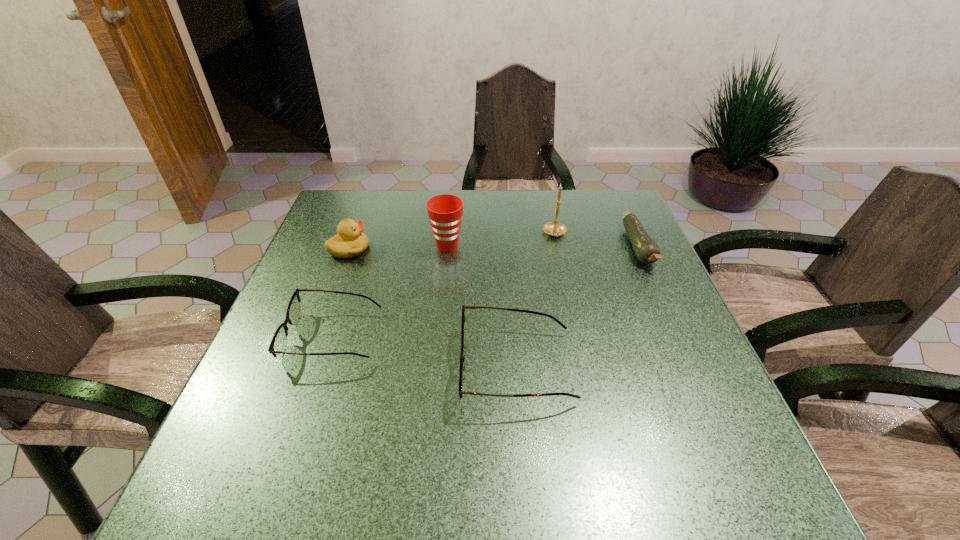
Locate an element on the screen. vacant space situated on the face of the right spectacles is located at coordinates (294, 367).

Where is `vacant region located 0.310m on the face of the right spectacles`? vacant region located 0.310m on the face of the right spectacles is located at coordinates [309, 367].

Where is `vacant space situated on the front-facing side of the third tallest object`? Image resolution: width=960 pixels, height=540 pixels. vacant space situated on the front-facing side of the third tallest object is located at coordinates (395, 249).

I want to click on free space located on the handle side of the candle holder, so pyautogui.click(x=566, y=287).

Where is `free space located 0.200m on the back of the third object from left to right`? The image size is (960, 540). free space located 0.200m on the back of the third object from left to right is located at coordinates (451, 199).

At what (x,y) coordinates should I click in order to perform the action: click on vacant space located 0.400m at the blossom end of the zucchini. Please return your answer as a coordinate pair (x, y). The image size is (960, 540). Looking at the image, I should click on (713, 415).

Find the location of a particular element. The width and height of the screenshot is (960, 540). candle holder at the far edge is located at coordinates (554, 228).

You are a GUI agent. You are given a task and a screenshot of the screen. Output one action in this format:
    pyautogui.click(x=<x>, y=<y>)
    Task: Click on the zucchini present at the far edge
    The image size is (960, 540).
    Given the screenshot: What is the action you would take?
    pyautogui.click(x=647, y=251)

The image size is (960, 540). In order to click on object at the near edge in this screenshot , I will do `click(462, 358)`.

At what (x,y) coordinates should I click in order to perform the action: click on spectacles situated at the left edge. Please return your answer as a coordinate pair (x, y). Looking at the image, I should click on (278, 344).